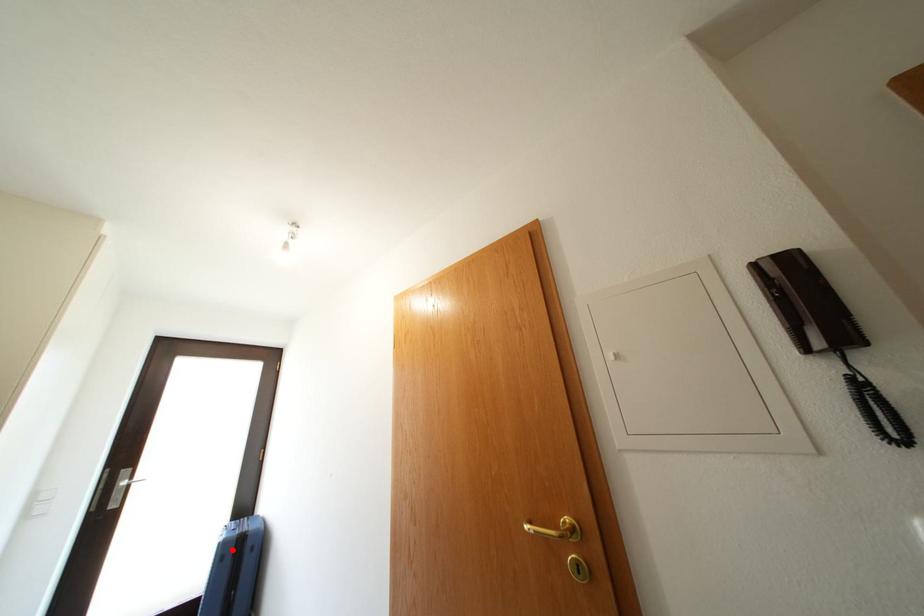
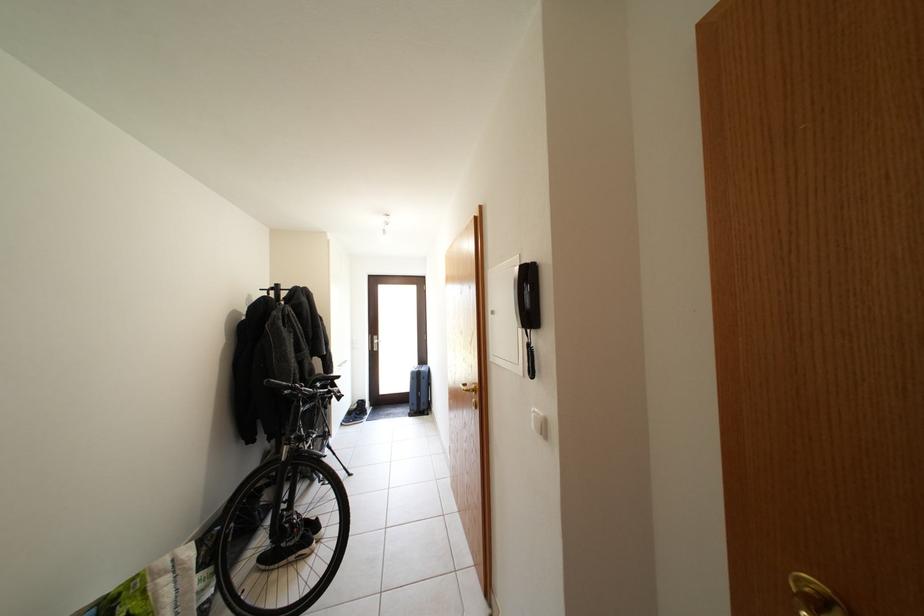
Question: I am providing you with two images of the same scene from different viewpoints. In image1, a red point is highlighted. Considering the same 3D point in image2, which of the following is correct?

Choices:
 (A) It is closer
 (B) It is farther

Answer: (B)